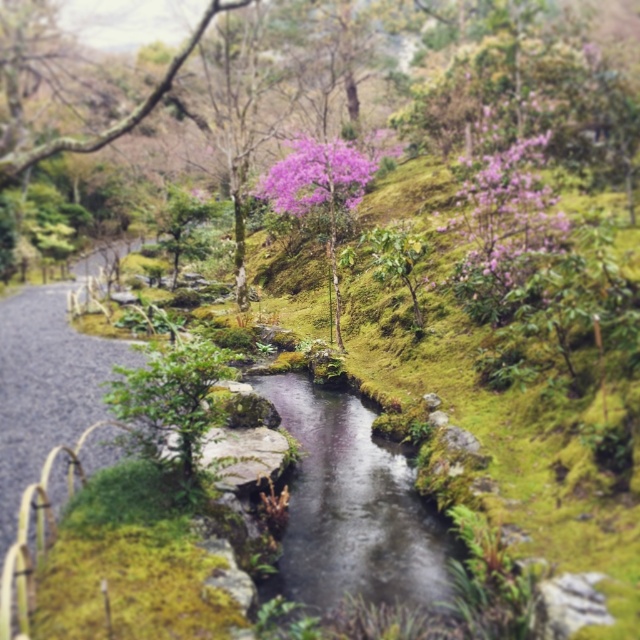
Question: Is clear water stream at center bigger than purple matte flowers at upper right?

Choices:
 (A) no
 (B) yes

Answer: (B)

Question: Is purple matte flowers at upper right to the left of purple matte flower at center from the viewer's perspective?

Choices:
 (A) no
 (B) yes

Answer: (A)

Question: Which point is farther to the camera?

Choices:
 (A) (296, 182)
 (B) (554, 211)

Answer: (A)

Question: Is clear water stream at center positioned at the back of purple matte flower at center?

Choices:
 (A) no
 (B) yes

Answer: (A)

Question: Which object is the closest to the purple matte flowers at upper right?

Choices:
 (A) clear water stream at center
 (B) purple matte flower at center

Answer: (A)

Question: Which object is closer to the camera taking this photo?

Choices:
 (A) clear water stream at center
 (B) purple matte flowers at upper right

Answer: (A)